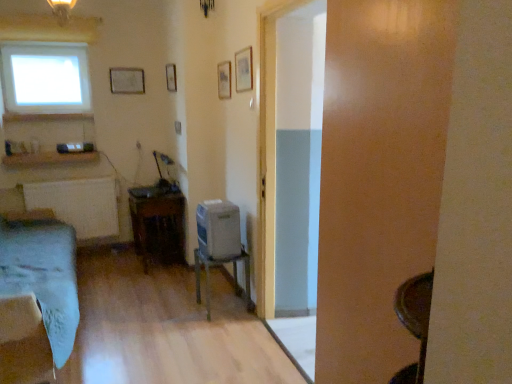
Where is `space that is in front of metallic gray table at center, arranged as the second table when viewed from the back`? This screenshot has width=512, height=384. space that is in front of metallic gray table at center, arranged as the second table when viewed from the back is located at coordinates (223, 327).